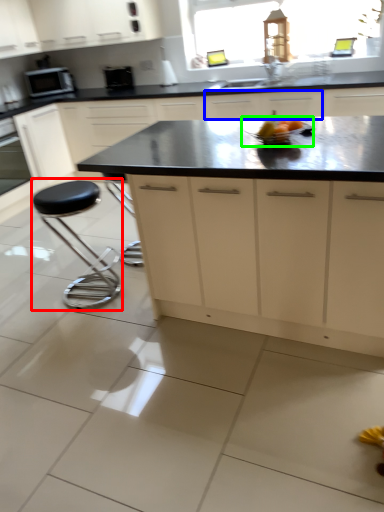
Question: Which object is the farthest from stool (highlighted by a red box)? Choose among these: cabinetry (highlighted by a blue box) or appliance (highlighted by a green box).

Choices:
 (A) cabinetry
 (B) appliance

Answer: (A)